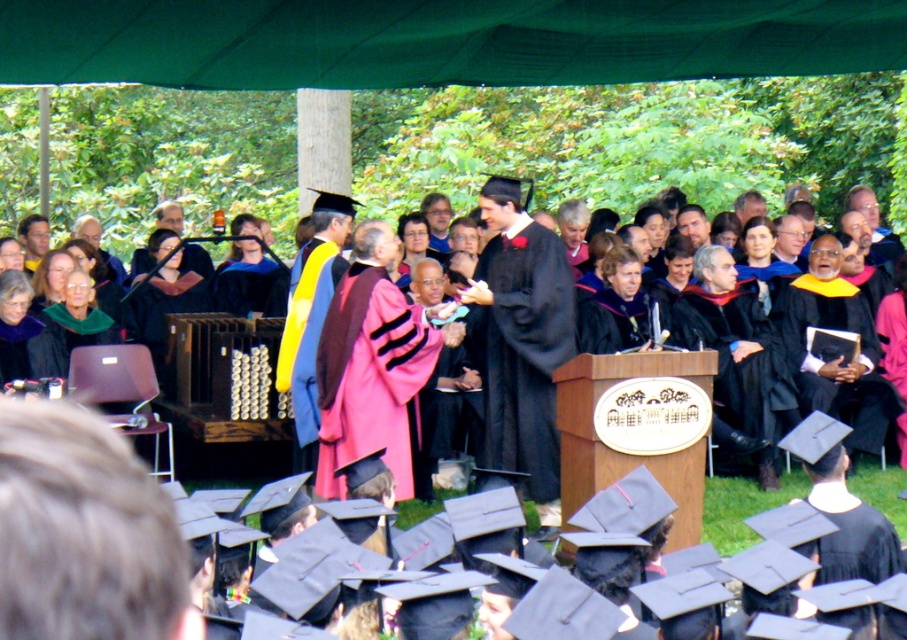
Can you confirm if pink velvet gown at center is positioned below pink velvet robe at center?

No, pink velvet gown at center is not below pink velvet robe at center.

Can you confirm if pink velvet gown at center is thinner than pink velvet robe at center?

Indeed, pink velvet gown at center has a lesser width compared to pink velvet robe at center.

You are a GUI agent. You are given a task and a screenshot of the screen. Output one action in this format:
    pyautogui.click(x=<x>, y=<y>)
    Task: Click on the pink velvet gown at center
    
    Given the screenshot: What is the action you would take?
    pyautogui.click(x=662, y=468)

Who is shorter, pink velvet gown at center or matte black graduation gown at center?

With less height is pink velvet gown at center.

Is point (251, 246) positioned after point (542, 243)?

Yes, point (251, 246) is farther from viewer.

At what (x,y) coordinates should I click in order to perform the action: click on pink velvet gown at center. Please return your answer as a coordinate pair (x, y). This screenshot has width=907, height=640. Looking at the image, I should click on (662, 468).

Is matte black graduation gown at center positioned at the back of pink velvet robe at center?

Yes, it is behind pink velvet robe at center.

Does matte black graduation gown at center appear on the right side of pink velvet robe at center?

Indeed, matte black graduation gown at center is positioned on the right side of pink velvet robe at center.

Which is behind, point (506, 385) or point (372, 332)?

The point (506, 385) is more distant.

Image resolution: width=907 pixels, height=640 pixels. I want to click on matte black graduation gown at center, so click(x=522, y=340).